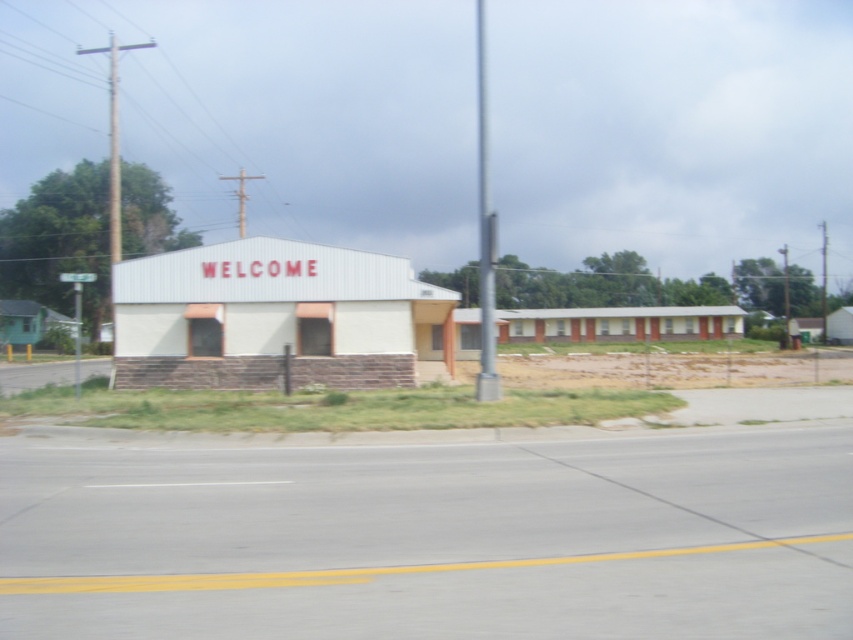
What do you see at coordinates (270, 316) in the screenshot? I see `white matte building at center` at bounding box center [270, 316].

Between point (247, 314) and point (483, 384), which one is positioned in front?

Point (483, 384)

Does point (297, 355) come farther from viewer compared to point (480, 81)?

No, it is not.

This screenshot has height=640, width=853. In order to click on white matte building at center in this screenshot , I will do `click(270, 316)`.